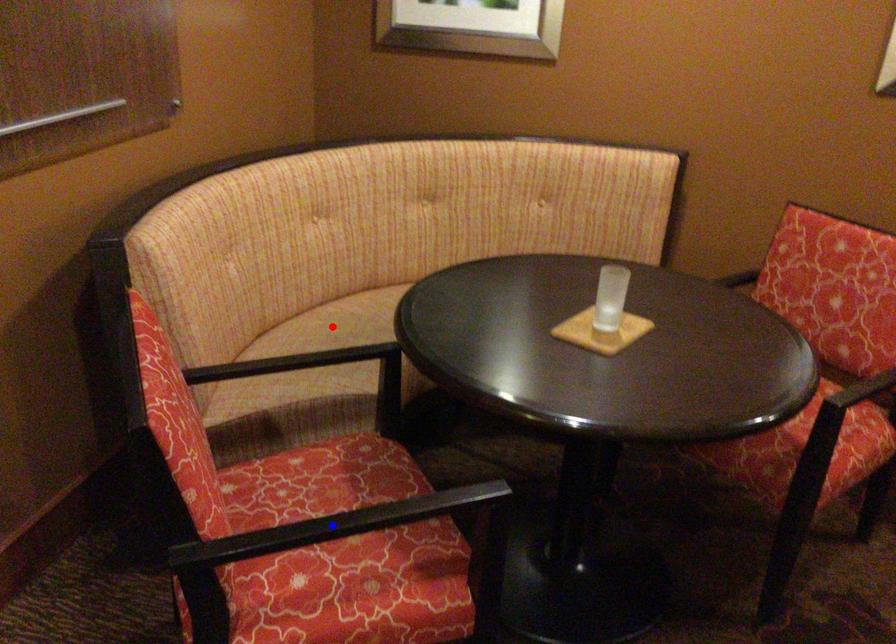
Question: In the image, two points are highlighted. Which point is nearer to the camera? Reply with the corresponding letter.

Choices:
 (A) blue point
 (B) red point

Answer: (A)